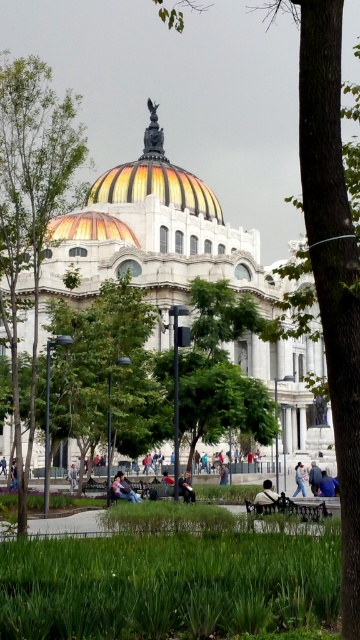
Question: Which object appears closest to the camera in this image?

Choices:
 (A) green leafy tree at left
 (B) light brown wooden bench at center

Answer: (A)

Question: Considering the relative positions of blue denim jeans at lower center and blue denim jeans at center in the image provided, where is blue denim jeans at lower center located with respect to blue denim jeans at center?

Choices:
 (A) below
 (B) above

Answer: (A)

Question: Which object is farther from the camera taking this photo?

Choices:
 (A) light brown wooden bench at center
 (B) blue denim jeans at center
 (C) wooden park bench at lower center
 (D) dark blue jeans at center

Answer: (B)

Question: Which object appears closest to the camera in this image?

Choices:
 (A) blue denim jeans at lower center
 (B) light blue jeans at center
 (C) dark brown leather jacket at center
 (D) green grass at lower center

Answer: (D)

Question: Is green leafy tree at center above denim jacket at lower center?

Choices:
 (A) no
 (B) yes

Answer: (B)

Question: Is the position of green leafy tree at left more distant than that of blue denim jeans at center?

Choices:
 (A) yes
 (B) no

Answer: (B)